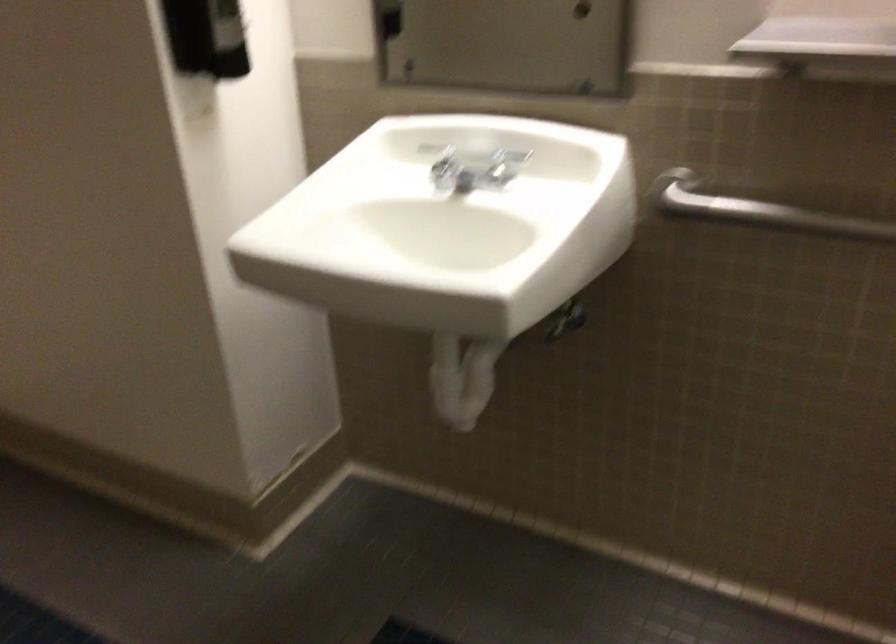
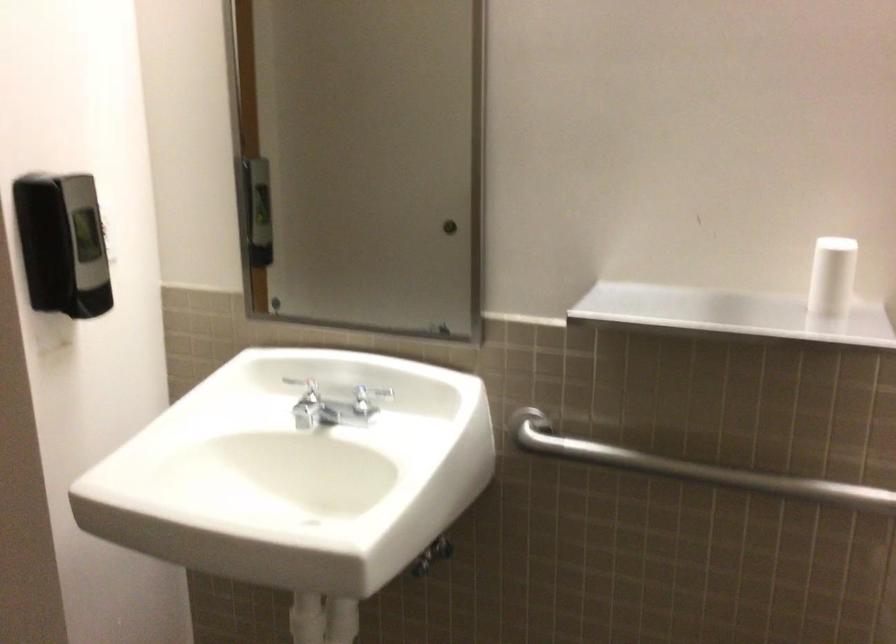
The images are taken continuously from a first-person perspective. In which direction are you moving?

The cameraman walked toward right, backward.